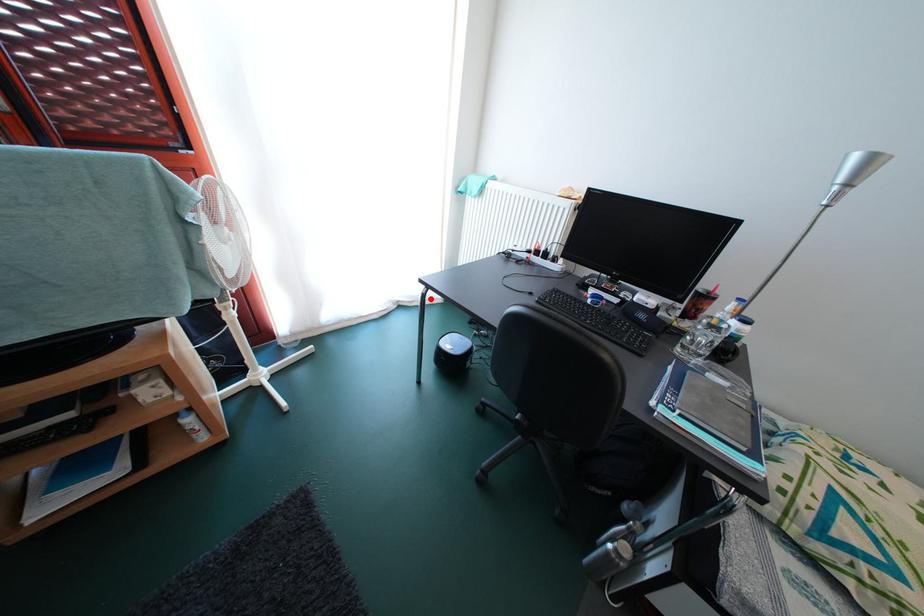
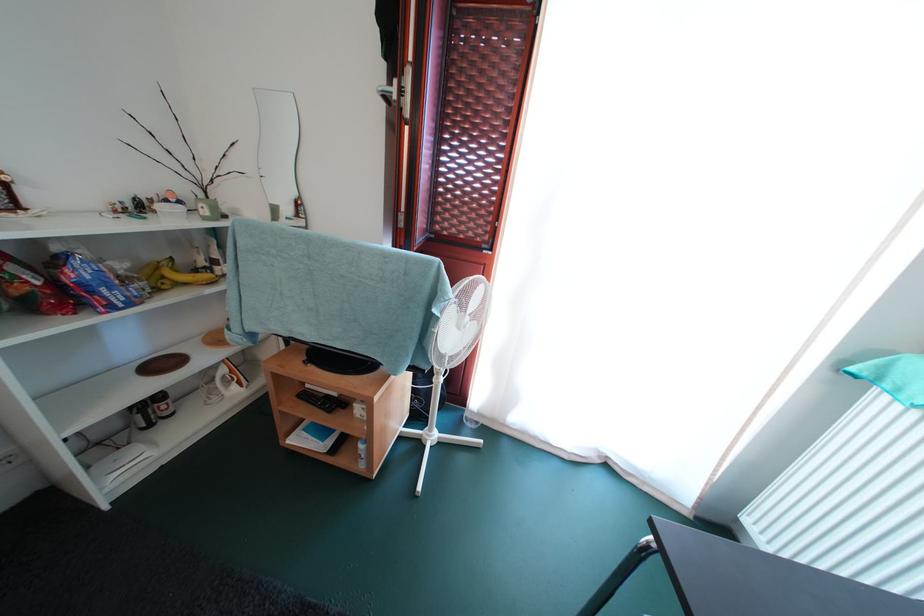
Question: I am providing you with two images of the same scene from different viewpoints. Given a red point in image1, look at the same physical point in image2. Is it:

Choices:
 (A) Closer to the viewpoint
 (B) Farther from the viewpoint

Answer: (B)